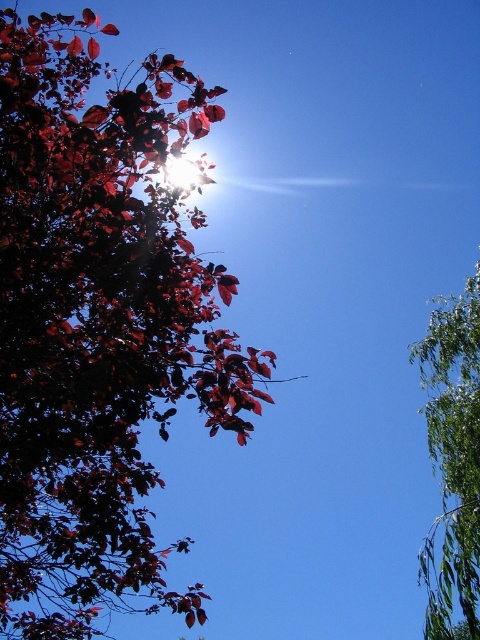
Does shiny red leaves at upper left come behind green leafy branch at right?

That is False.

Can you confirm if shiny red leaves at upper left is bigger than green leafy branch at right?

Yes.

Locate an element on the screen. shiny red leaves at upper left is located at coordinates (97, 326).

You are a GUI agent. You are given a task and a screenshot of the screen. Output one action in this format:
    pyautogui.click(x=<x>, y=<y>)
    Task: Click on the shiny red leaves at upper left
    The height and width of the screenshot is (640, 480).
    Given the screenshot: What is the action you would take?
    pyautogui.click(x=97, y=326)